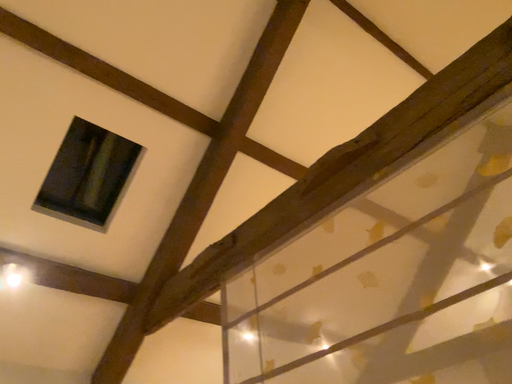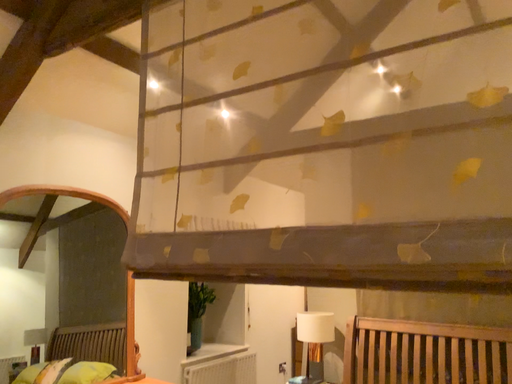
Question: How did the camera likely rotate when shooting the video?

Choices:
 (A) rotated upward
 (B) rotated downward

Answer: (B)